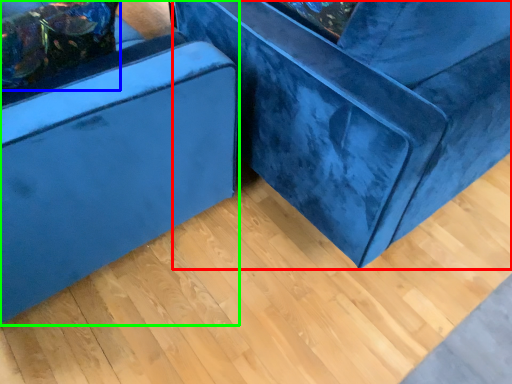
Question: Which object is positioned closest to furniture (highlighted by a red box)? Select from pillow (highlighted by a blue box) and furniture (highlighted by a green box).

Choices:
 (A) pillow
 (B) furniture

Answer: (B)